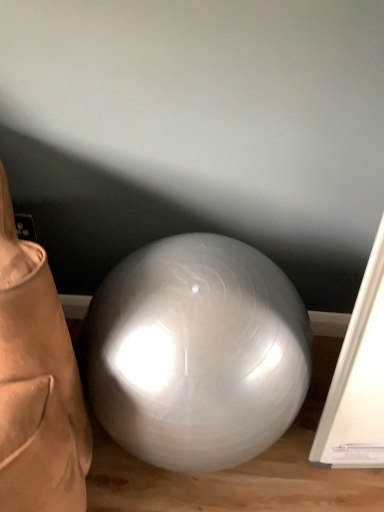
Question: Should I look upward or downward to see glossy white ball at center?

Choices:
 (A) up
 (B) down

Answer: (B)